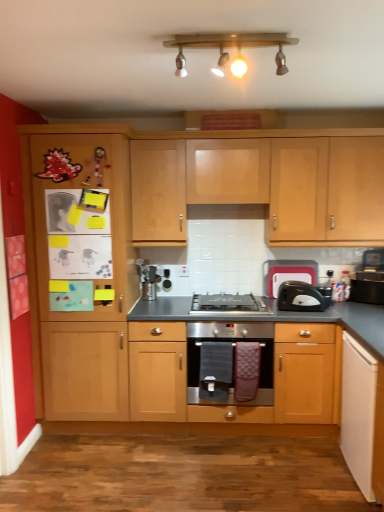
Question: Is light wood cabinet at upper center, acting as the first cabinetry starting from the top, inside or outside of wooden ceiling lights at upper center?

Choices:
 (A) outside
 (B) inside

Answer: (A)

Question: In the image, is light wood cabinet at upper center, marked as the third cabinetry in a bottom-to-top arrangement, positioned in front of or behind wooden ceiling lights at upper center?

Choices:
 (A) behind
 (B) front

Answer: (A)

Question: Estimate the real-world distances between objects in this image. Which object is farther from the satin black gas stove at center?

Choices:
 (A) black plastic toaster at right, the 1th appliance when ordered from back to front
 (B) wooden ceiling lights at upper center
 (C) white matte cabinet at lower right, which appears as the third cabinetry when viewed from the top
 (D) wooden cabinet at center, marked as the 2th cabinetry in a bottom-to-top arrangement
 (E) light wood cabinet at upper center, acting as the first cabinetry starting from the top

Answer: (B)

Question: Considering the real-world distances, which object is closest to the wooden cabinet at left?

Choices:
 (A) black plastic toaster at right, the 1th appliance when ordered from back to front
 (B) black plastic toaster at right
 (C) light wood cabinet at upper center, acting as the first cabinetry starting from the top
 (D) satin silver oven at center
 (E) satin black gas stove at center

Answer: (D)